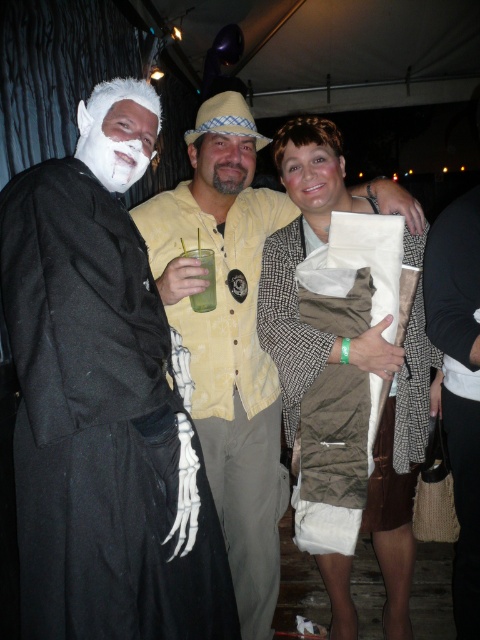
You are a photographer at a costume party. You want to take a closeup photo of the smooth skin face at center. The camera you are using has a minimum focusing distance of 1.5 meters. Will you be able to take the photo without moving closer?

The smooth skin face at center is 1.86 meters away from the camera, which is beyond the minimum focusing distance of 1.5 meters. Therefore, you can take the closeup photo without needing to move closer.

You are standing at the center of the tent and want to move towards the exit located at point A. There are two points marked in the scene, point 1 at coordinates (297, 164) and point 2 at coordinates (207, 273). Which point should you avoid stepping on to ensure you can reach the exit without obstruction?

You should avoid stepping on point 1 at coordinates (297, 164) because it is behind point 2 at coordinates (207, 273), which might block your path towards the exit.